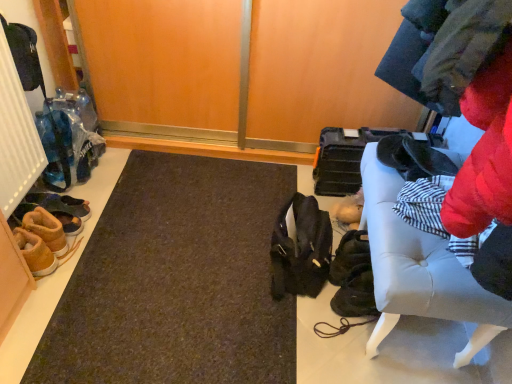
Question: Is brown suede shoes at lower left, marked as the 3th footwear in a back-to-front arrangement, not within leather sandal at left, acting as the 4th footwear starting from the front?

Choices:
 (A) yes
 (B) no

Answer: (A)

Question: From a real-world perspective, is brown suede shoes at lower left, marked as the 3th footwear in a back-to-front arrangement, located beneath leather sandal at left, acting as the 4th footwear starting from the front?

Choices:
 (A) yes
 (B) no

Answer: (B)

Question: Is leather sandal at left, acting as the 4th footwear starting from the front, at the back of brown suede shoes at lower left, marked as the 3th footwear in a back-to-front arrangement?

Choices:
 (A) yes
 (B) no

Answer: (B)

Question: Considering the relative sizes of brown suede shoes at lower left, arranged as the second footwear when viewed from the front, and leather sandal at left, which is counted as the 1th footwear, starting from the back, in the image provided, is brown suede shoes at lower left, arranged as the second footwear when viewed from the front, wider than leather sandal at left, which is counted as the 1th footwear, starting from the back,?

Choices:
 (A) yes
 (B) no

Answer: (B)

Question: Is brown suede shoes at lower left, marked as the 3th footwear in a back-to-front arrangement, positioned far away from leather sandal at left, which is counted as the 1th footwear, starting from the back?

Choices:
 (A) yes
 (B) no

Answer: (B)

Question: From a real-world perspective, is brown suede shoes at lower left, which ranks as the 2th footwear in back-to-front order, above or below brown suede shoes at lower left, arranged as the second footwear when viewed from the front?

Choices:
 (A) below
 (B) above

Answer: (A)

Question: Considering the positions of brown suede shoes at lower left, which ranks as the 2th footwear in back-to-front order, and brown suede shoes at lower left, marked as the 3th footwear in a back-to-front arrangement, in the image, is brown suede shoes at lower left, which ranks as the 2th footwear in back-to-front order, wider or thinner than brown suede shoes at lower left, marked as the 3th footwear in a back-to-front arrangement,?

Choices:
 (A) thin
 (B) wide

Answer: (B)

Question: Considering the positions of point (71, 230) and point (57, 264), is point (71, 230) closer or farther from the camera than point (57, 264)?

Choices:
 (A) farther
 (B) closer

Answer: (A)

Question: Considering their positions, is brown suede shoes at lower left, the 3th footwear in the front-to-back sequence, located in front of or behind brown suede shoes at lower left, arranged as the second footwear when viewed from the front?

Choices:
 (A) front
 (B) behind

Answer: (B)

Question: From a real-world perspective, is matte black shoulder bag at center positioned above or below white leather bench at right?

Choices:
 (A) below
 (B) above

Answer: (A)

Question: From the image's perspective, relative to white leather bench at right, is matte black shoulder bag at center above or below?

Choices:
 (A) above
 (B) below

Answer: (A)

Question: In terms of size, does matte black shoulder bag at center appear bigger or smaller than white leather bench at right?

Choices:
 (A) big
 (B) small

Answer: (B)

Question: Would you say matte black shoulder bag at center is to the left or to the right of white leather bench at right in the picture?

Choices:
 (A) right
 (B) left

Answer: (B)

Question: Considering the positions of point (32, 205) and point (30, 238), is point (32, 205) closer or farther from the camera than point (30, 238)?

Choices:
 (A) closer
 (B) farther

Answer: (B)

Question: Is brown suede shoes at lower left, the 3th footwear in the front-to-back sequence, bigger or smaller than tan suede boot at lower left, arranged as the first footwear when viewed from the front?

Choices:
 (A) small
 (B) big

Answer: (A)